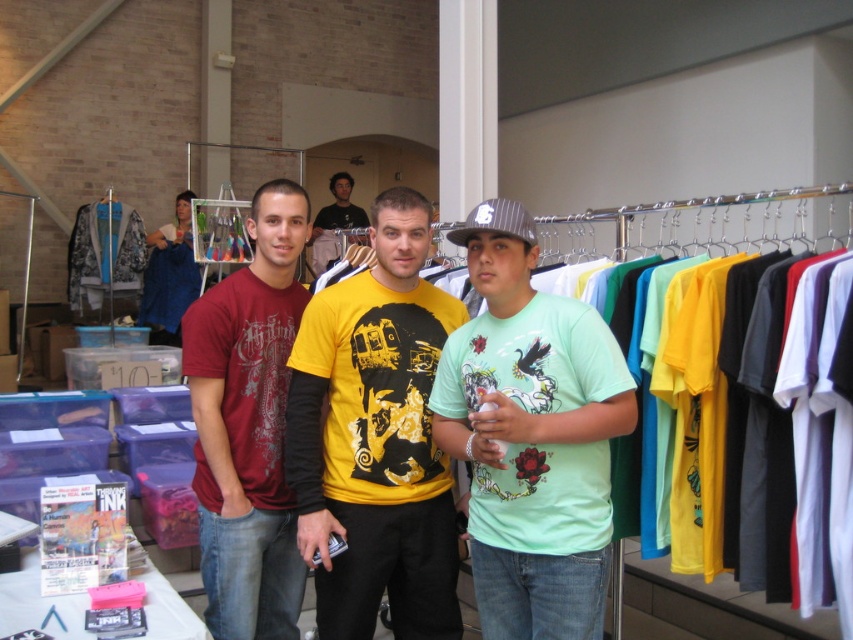
Who is shorter, light green matte t-shirt at center or matte red t-shirt at left?

light green matte t-shirt at center

Is light green matte t-shirt at center further to camera compared to matte red t-shirt at left?

No, it is in front of matte red t-shirt at left.

What do you see at coordinates (531, 435) in the screenshot? I see `light green matte t-shirt at center` at bounding box center [531, 435].

You are a GUI agent. You are given a task and a screenshot of the screen. Output one action in this format:
    pyautogui.click(x=<x>, y=<y>)
    Task: Click on the light green matte t-shirt at center
    This screenshot has height=640, width=853.
    Given the screenshot: What is the action you would take?
    pyautogui.click(x=531, y=435)

Identify the location of yellow printed t-shirt at center. (375, 438).

Based on the photo, who is positioned more to the right, yellow printed t-shirt at center or gray striped baseball cap at center?

Positioned to the right is gray striped baseball cap at center.

This screenshot has height=640, width=853. Identify the location of yellow printed t-shirt at center. (375, 438).

You are a GUI agent. You are given a task and a screenshot of the screen. Output one action in this format:
    pyautogui.click(x=<x>, y=<y>)
    Task: Click on the yellow printed t-shirt at center
    
    Given the screenshot: What is the action you would take?
    pyautogui.click(x=375, y=438)

Which is behind, point (271, 445) or point (311, 236)?

The point (311, 236) is more distant.

Looking at this image, who is higher up, matte red t-shirt at left or yellow matte t-shirt at center?

Positioned higher is yellow matte t-shirt at center.

Does point (305, 208) come farther from viewer compared to point (316, 260)?

No, it is not.

Locate an element on the screen. The width and height of the screenshot is (853, 640). matte red t-shirt at left is located at coordinates (248, 426).